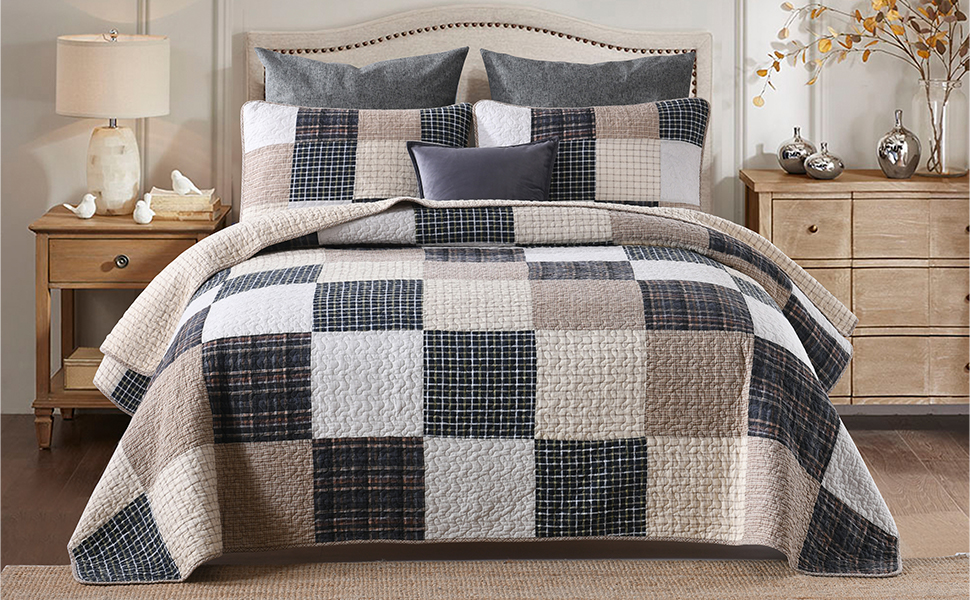
Locate an element on the screen. Image resolution: width=970 pixels, height=600 pixels. wooden floor is located at coordinates (48, 477).